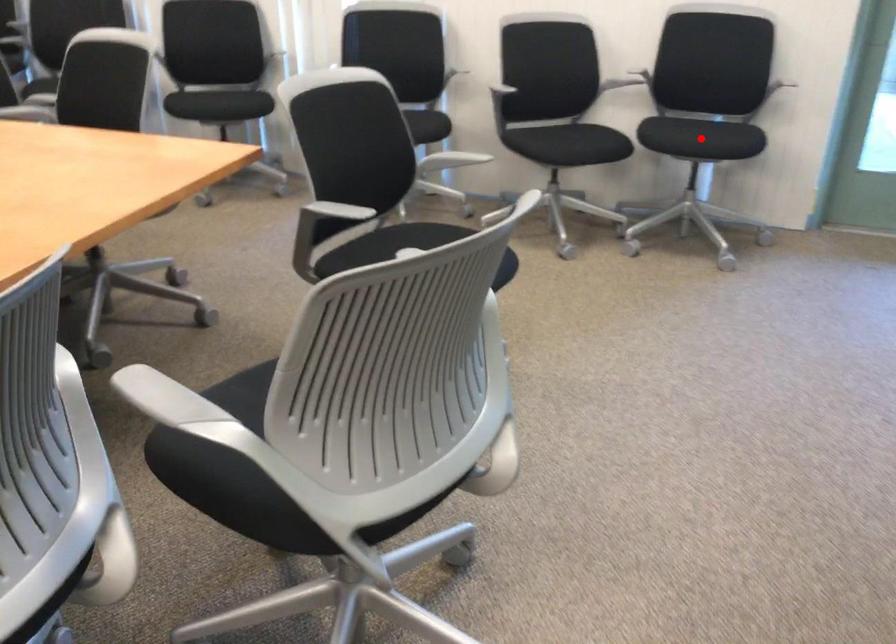
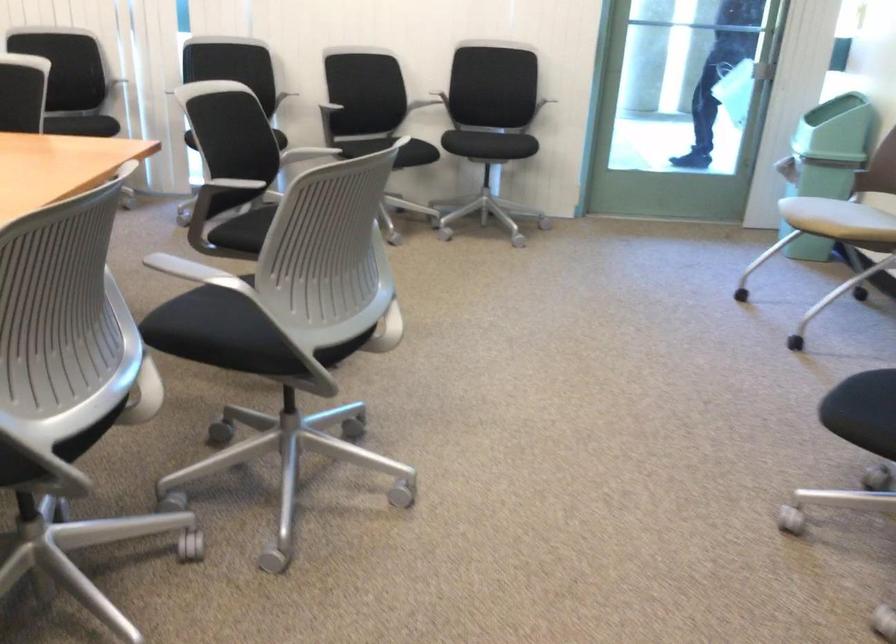
Question: I am providing you with two images of the same scene from different viewpoints. A red point is marked on the first image. Can you still see the location of the red point in image 2?

Choices:
 (A) Yes
 (B) No

Answer: (B)